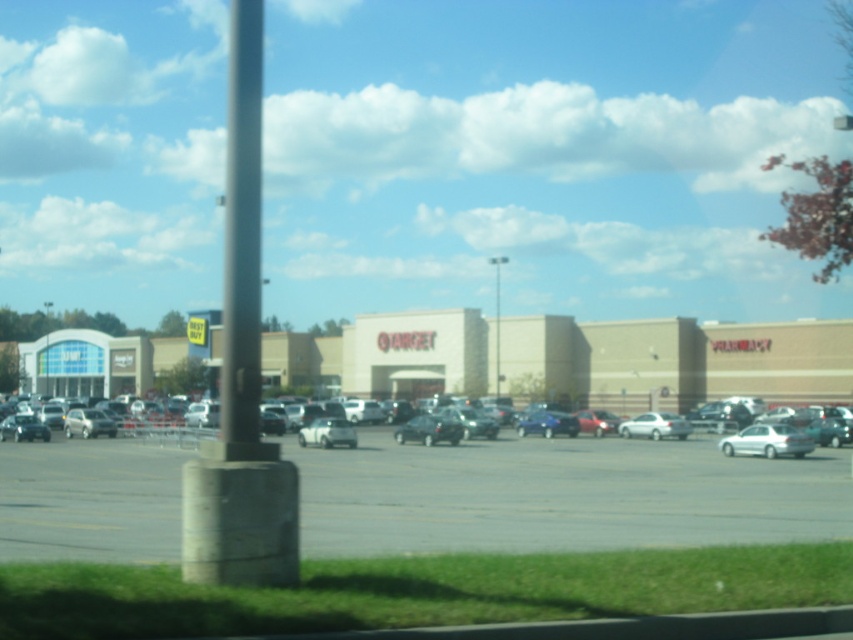
What is the exact coordinate of the beige brick mall at center?

The beige brick mall at center is located at point (674, 362).

Based on the photo, you are a delivery driver who needs to park your truck in the gray asphalt parking lot at center. However, your truck is 2 meters tall. Can you safely park there if the silver metallic sedan at lower center is already occupying part of the parking space?

The gray asphalt parking lot at center has a greater height compared to the silver metallic sedan at lower center. Since the parking lot is taller than the sedan, the truck can safely park there as the height is sufficient.